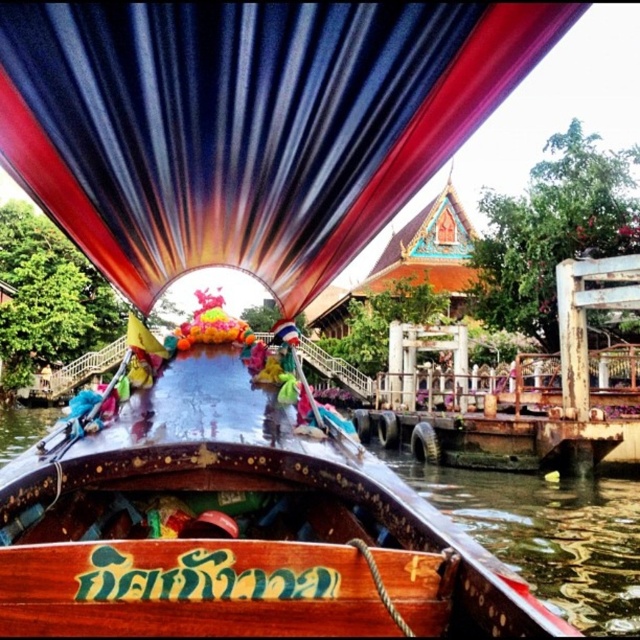
Based on the photo, who is taller, blue striped fabric canopy at center or polished wood boat at center?

polished wood boat at center is taller.

Locate an element on the screen. blue striped fabric canopy at center is located at coordinates (248, 124).